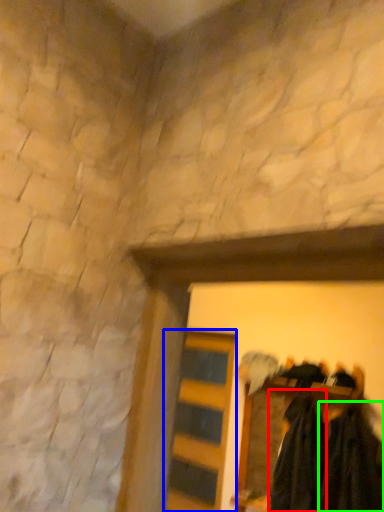
Question: Which is farther away from clothing (highlighted by a red box)? barn door (highlighted by a blue box) or clothing (highlighted by a green box)?

Choices:
 (A) barn door
 (B) clothing

Answer: (A)